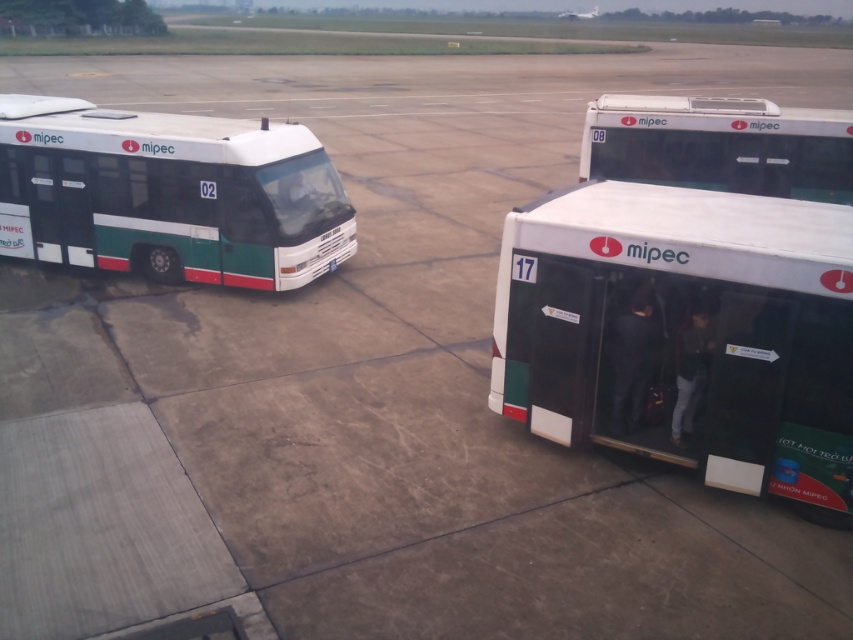
Question: Is green matte bus at left bigger than white matte bus at upper right?

Choices:
 (A) no
 (B) yes

Answer: (A)

Question: Among these points, which one is nearest to the camera?

Choices:
 (A) (804, 163)
 (B) (91, 200)

Answer: (B)

Question: Which object is the farthest from the white matte bus at upper right?

Choices:
 (A) white matte bus at right
 (B) green matte bus at left

Answer: (B)

Question: Which object is closer to the camera taking this photo?

Choices:
 (A) green matte bus at left
 (B) white matte bus at upper right

Answer: (A)

Question: Considering the relative positions of white matte bus at right and white matte bus at upper right in the image provided, where is white matte bus at right located with respect to white matte bus at upper right?

Choices:
 (A) right
 (B) left

Answer: (B)

Question: Is green matte bus at left smaller than white matte bus at upper right?

Choices:
 (A) no
 (B) yes

Answer: (B)